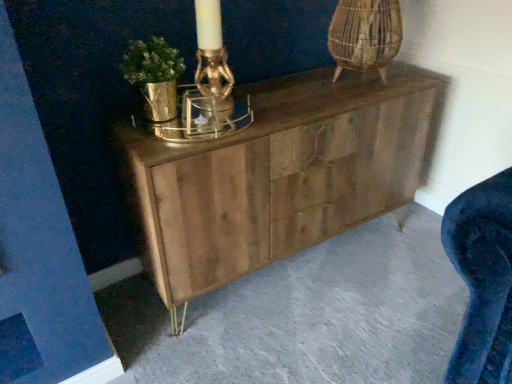
Question: From a real-world perspective, relative to natural wood cabinet at center, is wooden chest of drawers at center vertically above or below?

Choices:
 (A) below
 (B) above

Answer: (B)

Question: Based on their positions, is wooden chest of drawers at center located to the left or right of natural wood cabinet at center?

Choices:
 (A) left
 (B) right

Answer: (A)

Question: Is wooden chest of drawers at center inside or outside of natural wood cabinet at center?

Choices:
 (A) outside
 (B) inside

Answer: (A)

Question: Is natural wood cabinet at center in front of or behind wooden chest of drawers at center in the image?

Choices:
 (A) front
 (B) behind

Answer: (A)

Question: Is natural wood cabinet at center inside the boundaries of wooden chest of drawers at center, or outside?

Choices:
 (A) inside
 (B) outside

Answer: (B)

Question: Is natural wood cabinet at center taller or shorter than wooden chest of drawers at center?

Choices:
 (A) short
 (B) tall

Answer: (A)

Question: Considering the positions of point (215, 372) and point (413, 140), is point (215, 372) closer or farther from the camera than point (413, 140)?

Choices:
 (A) farther
 (B) closer

Answer: (B)